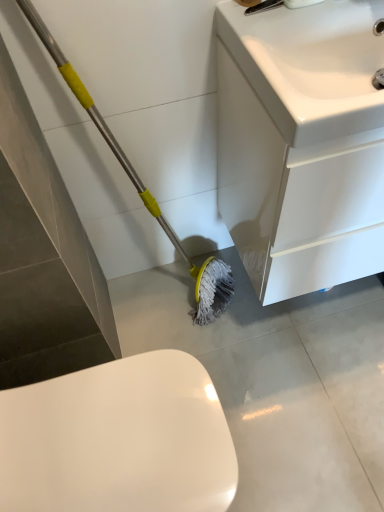
At what (x,y) coordinates should I click in order to perform the action: click on white glossy cabinet at lower right. Please return your answer as a coordinate pair (x, y). The width and height of the screenshot is (384, 512). Looking at the image, I should click on (302, 142).

From a real-world perspective, who is located lower, white glossy cabinet at lower right or white glossy toilet at lower left?

white glossy toilet at lower left is physically lower.

Is white glossy cabinet at lower right aimed at white glossy toilet at lower left?

No, white glossy cabinet at lower right is not aimed at white glossy toilet at lower left.

From the image's perspective, relative to white glossy toilet at lower left, is white glossy cabinet at lower right above or below?

From the image's perspective, white glossy cabinet at lower right appears above white glossy toilet at lower left.

Is point (279, 109) closer to camera compared to point (219, 505)?

Yes.

In the scene shown: Could you tell me if white glossy toilet at lower left is facing white glossy sink at upper right?

No, white glossy toilet at lower left is not turned towards white glossy sink at upper right.

Can you confirm if white glossy toilet at lower left is thinner than white glossy sink at upper right?

In fact, white glossy toilet at lower left might be wider than white glossy sink at upper right.

Is white glossy toilet at lower left positioned beyond the bounds of white glossy sink at upper right?

Indeed, white glossy toilet at lower left is completely outside white glossy sink at upper right.

From a real-world perspective, is white glossy cabinet at lower right located higher than white glossy sink at upper right?

No, from a real-world perspective, white glossy cabinet at lower right is not over white glossy sink at upper right

Which is more to the right, white glossy cabinet at lower right or white glossy sink at upper right?

Positioned to the right is white glossy cabinet at lower right.

Is white glossy cabinet at lower right surrounding white glossy sink at upper right?

Yes, white glossy sink at upper right can be found within white glossy cabinet at lower right.

Are white glossy cabinet at lower right and white glossy sink at upper right far apart?

No, white glossy cabinet at lower right is not far away from white glossy sink at upper right.

Which of these two, white glossy sink at upper right or white glossy cabinet at lower right, stands shorter?

white glossy sink at upper right.

Which is less distant, (278, 89) or (270, 198)?

The point (278, 89) is closer to the camera.

From the picture: Is white glossy sink at upper right turned away from white glossy cabinet at lower right?

Yes.

In terms of width, does white glossy sink at upper right look wider or thinner when compared to white glossy cabinet at lower right?

Clearly, white glossy sink at upper right has more width compared to white glossy cabinet at lower right.

In terms of size, does white glossy sink at upper right appear bigger or smaller than white glossy toilet at lower left?

In the image, white glossy sink at upper right appears to be smaller than white glossy toilet at lower left.

From a real-world perspective, who is located higher, white glossy sink at upper right or white glossy toilet at lower left?

white glossy sink at upper right is physically above.

Is white glossy sink at upper right inside the boundaries of white glossy toilet at lower left, or outside?

white glossy sink at upper right lies outside white glossy toilet at lower left.

Is white glossy sink at upper right not close to white glossy toilet at lower left?

No, there isn't a large distance between white glossy sink at upper right and white glossy toilet at lower left.

From a real-world perspective, is white glossy toilet at lower left physically located above or below white glossy cabinet at lower right?

In terms of real-world spatial position, white glossy toilet at lower left is below white glossy cabinet at lower right.

Between white glossy toilet at lower left and white glossy cabinet at lower right, which one has larger width?

Wider between the two is white glossy toilet at lower left.

From the image's perspective, which is below, white glossy toilet at lower left or white glossy cabinet at lower right?

white glossy toilet at lower left is shown below in the image.

Considering the positions of objects white glossy toilet at lower left and white glossy cabinet at lower right in the image provided, who is in front, white glossy toilet at lower left or white glossy cabinet at lower right?

white glossy toilet at lower left is more forward.

This screenshot has height=512, width=384. I want to click on bathroom cabinet that appears behind the white glossy toilet at lower left, so click(302, 142).

Find the location of a particular element. sink located above the white glossy toilet at lower left (from a real-world perspective) is located at coordinates (310, 66).

Considering their positions, is white glossy toilet at lower left positioned further to white glossy sink at upper right than white glossy cabinet at lower right?

white glossy toilet at lower left lies further to white glossy sink at upper right than the other object.

Estimate the real-world distances between objects in this image. Which object is closer to white glossy cabinet at lower right, white glossy sink at upper right or white glossy toilet at lower left?

white glossy sink at upper right is positioned closer to the anchor white glossy cabinet at lower right.

Based on their spatial positions, is white glossy cabinet at lower right or white glossy toilet at lower left closer to white glossy sink at upper right?

A: Based on the image, white glossy cabinet at lower right appears to be nearer to white glossy sink at upper right.

Estimate the real-world distances between objects in this image. Which object is further from white glossy toilet at lower left, white glossy sink at upper right or white glossy cabinet at lower right?

The object further to white glossy toilet at lower left is white glossy sink at upper right.

Which object lies nearer to the anchor point white glossy toilet at lower left, white glossy cabinet at lower right or white glossy sink at upper right?

Among the two, white glossy cabinet at lower right is located nearer to white glossy toilet at lower left.

When comparing their distances from white glossy cabinet at lower right, does white glossy toilet at lower left or white glossy sink at upper right seem further?

white glossy toilet at lower left is further to white glossy cabinet at lower right.

This screenshot has height=512, width=384. I want to click on bathroom cabinet between white glossy sink at upper right and white glossy toilet at lower left vertically, so click(302, 142).